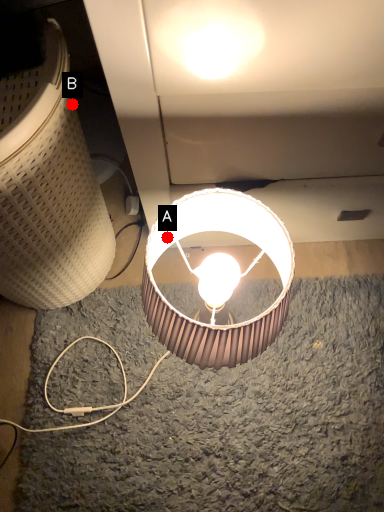
Question: Two points are circled on the image, labeled by A and B beside each circle. Which of the following is the farthest from the observer?

Choices:
 (A) A is further
 (B) B is further

Answer: (A)